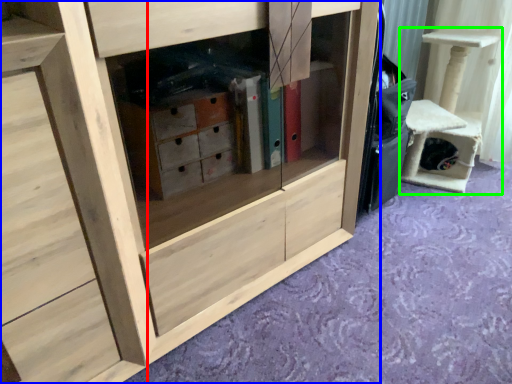
Question: Considering the real-world distances, which object is closest to chest of drawers (highlighted by a red box)? cabinetry (highlighted by a blue box) or furniture (highlighted by a green box).

Choices:
 (A) cabinetry
 (B) furniture

Answer: (A)